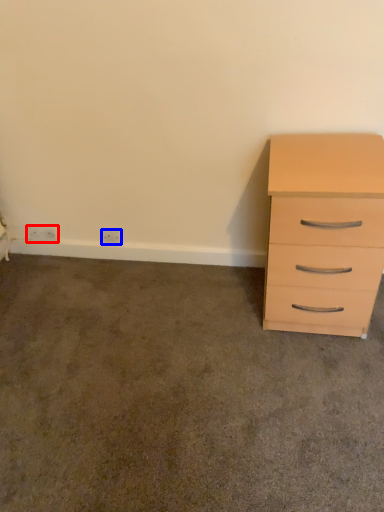
Question: Which point is further to the camera, electric outlet (highlighted by a red box) or electric outlet (highlighted by a blue box)?

Choices:
 (A) electric outlet
 (B) electric outlet

Answer: (A)